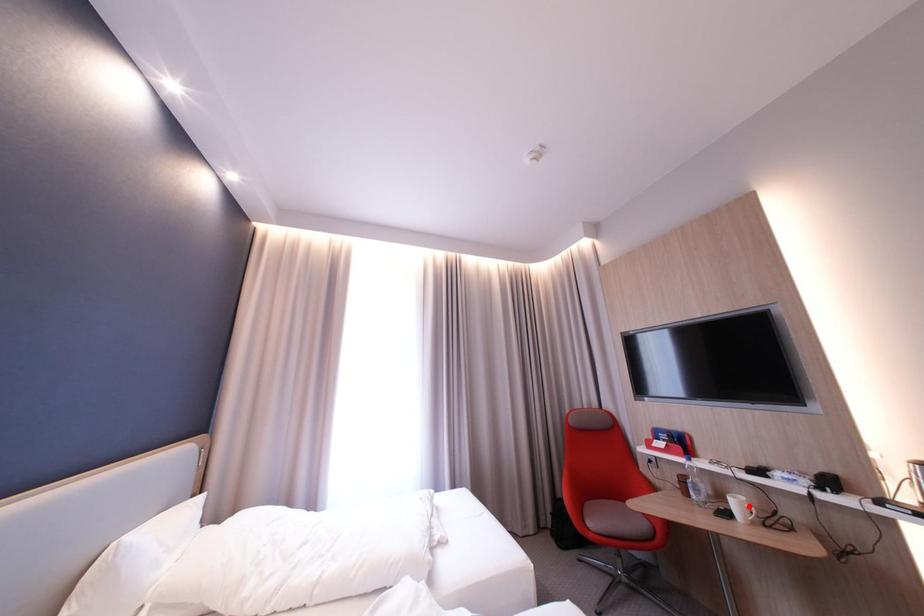
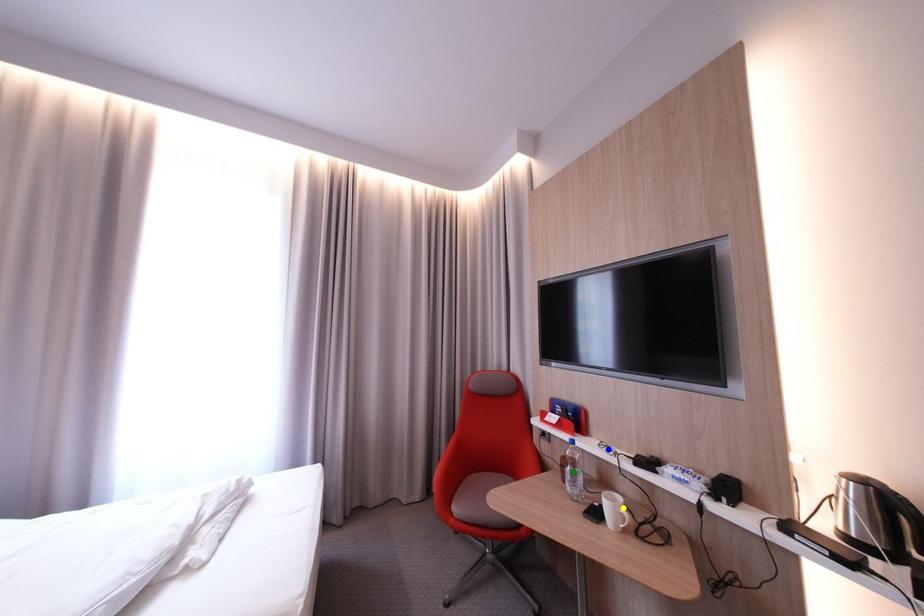
Question: I am providing you with two images of the same scene from different viewpoints. A red point is marked on the first image. You are given multiple points on the second image. Which spot in image 2 lines up with the point in image 1?

Choices:
 (A) yellow point
 (B) blue point
 (C) green point

Answer: (A)